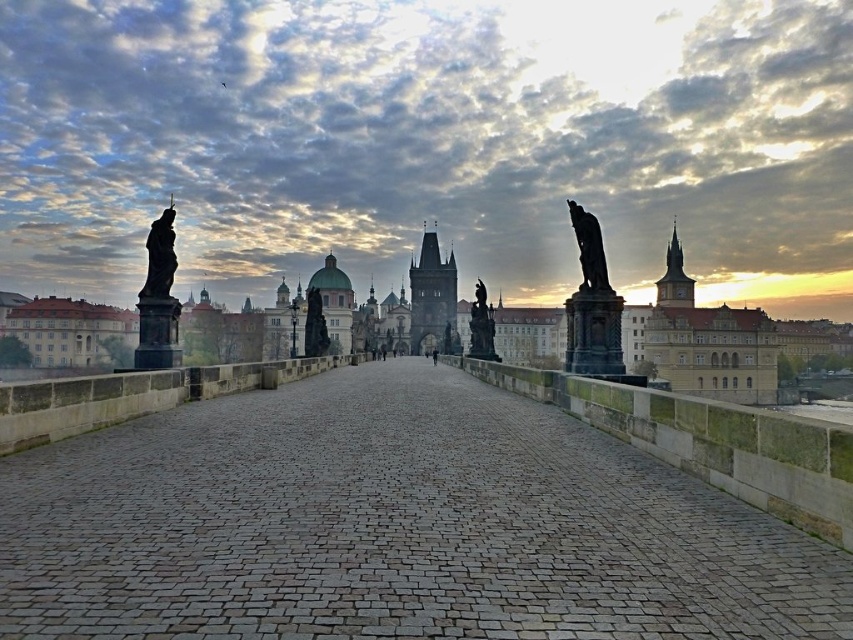
Is bronze statue at left taller than polished bronze statue at center?

Yes, bronze statue at left is taller than polished bronze statue at center.

Describe the element at coordinates (158, 300) in the screenshot. Image resolution: width=853 pixels, height=640 pixels. I see `bronze statue at left` at that location.

At what (x,y) coordinates should I click in order to perform the action: click on bronze statue at left. Please return your answer as a coordinate pair (x, y). The image size is (853, 640). Looking at the image, I should click on (158, 300).

In the scene shown: Who is more forward, (567,310) or (149,262)?

Point (149,262)

Does polished bronze statue at right lie behind bronze statue at left?

No, polished bronze statue at right is closer to the viewer.

Between point (596, 310) and point (149, 276), which one is positioned in front?

Positioned in front is point (596, 310).

You are a GUI agent. You are given a task and a screenshot of the screen. Output one action in this format:
    pyautogui.click(x=<x>, y=<y>)
    Task: Click on the polished bronze statue at right
    The image size is (853, 640).
    Given the screenshot: What is the action you would take?
    pyautogui.click(x=592, y=305)

I want to click on black stone statue at right, so (x=589, y=248).